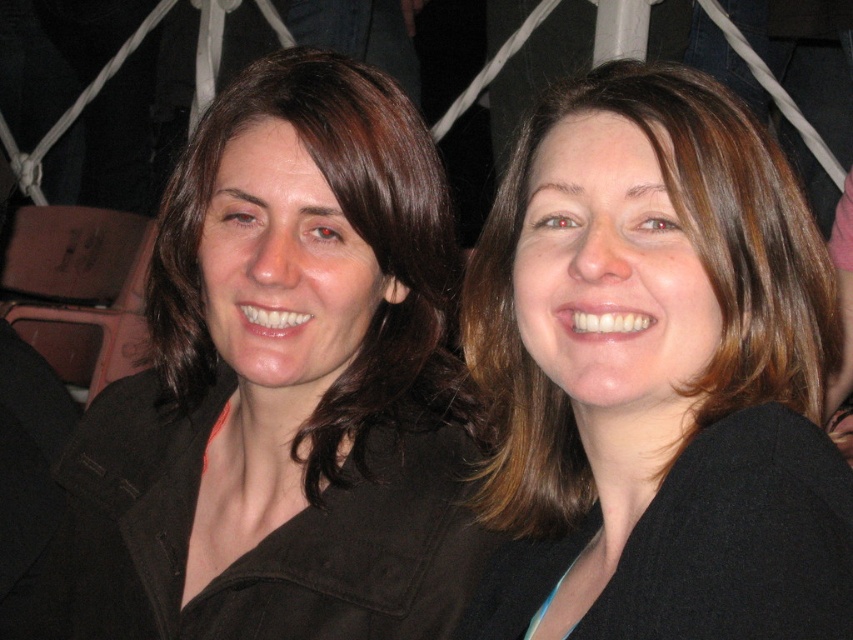
Does matte black jacket at center have a smaller size compared to brown matte/black jacket at center?

No.

Who is more distant from viewer, (337, 419) or (712, 355)?

Positioned behind is point (337, 419).

Is point (209, 532) farther from viewer compared to point (662, 163)?

Yes, it is behind point (662, 163).

Image resolution: width=853 pixels, height=640 pixels. What are the coordinates of `matte black jacket at center` in the screenshot? It's located at (281, 388).